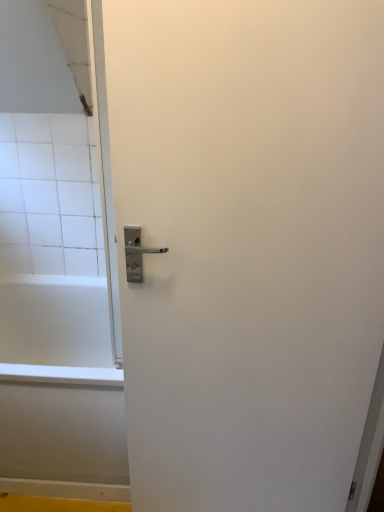
Question: Is white glossy bathtub at lower left next to white matte door handle at center and touching it?

Choices:
 (A) yes
 (B) no

Answer: (B)

Question: Does white glossy bathtub at lower left contain white matte door handle at center?

Choices:
 (A) no
 (B) yes

Answer: (A)

Question: Can you confirm if white glossy bathtub at lower left is bigger than white matte door handle at center?

Choices:
 (A) yes
 (B) no

Answer: (A)

Question: Is white glossy bathtub at lower left positioned in front of white matte door handle at center?

Choices:
 (A) yes
 (B) no

Answer: (B)

Question: Considering the relative sizes of white glossy bathtub at lower left and white matte door handle at center in the image provided, is white glossy bathtub at lower left shorter than white matte door handle at center?

Choices:
 (A) yes
 (B) no

Answer: (A)

Question: From a real-world perspective, is white glossy bathtub at lower left over white matte door handle at center?

Choices:
 (A) yes
 (B) no

Answer: (B)

Question: Is white matte door handle at center positioned behind white glossy bathtub at lower left?

Choices:
 (A) no
 (B) yes

Answer: (A)

Question: Could you tell me if white matte door handle at center is turned towards white glossy bathtub at lower left?

Choices:
 (A) no
 (B) yes

Answer: (A)

Question: From a real-world perspective, is white matte door handle at center positioned under white glossy bathtub at lower left based on gravity?

Choices:
 (A) yes
 (B) no

Answer: (B)

Question: Can you see white matte door handle at center touching white glossy bathtub at lower left?

Choices:
 (A) yes
 (B) no

Answer: (B)

Question: Is white matte door handle at center completely or partially outside of white glossy bathtub at lower left?

Choices:
 (A) no
 (B) yes

Answer: (B)

Question: Would you say white glossy bathtub at lower left is part of white matte door handle at center's contents?

Choices:
 (A) yes
 (B) no

Answer: (B)

Question: Considering the positions of point (190, 487) and point (56, 424), is point (190, 487) closer or farther from the camera than point (56, 424)?

Choices:
 (A) farther
 (B) closer

Answer: (B)